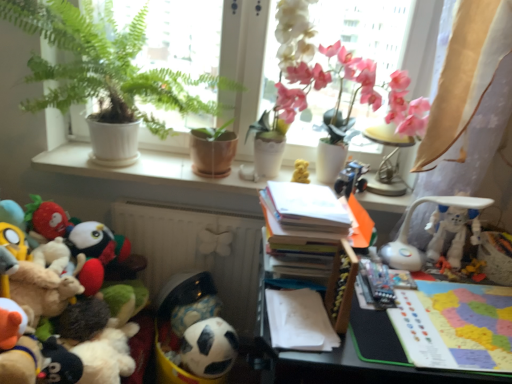
Image resolution: width=512 pixels, height=384 pixels. Find the location of `free space above smooth plastic table at lower right (from a real-world perspective)`. free space above smooth plastic table at lower right (from a real-world perspective) is located at coordinates (421, 313).